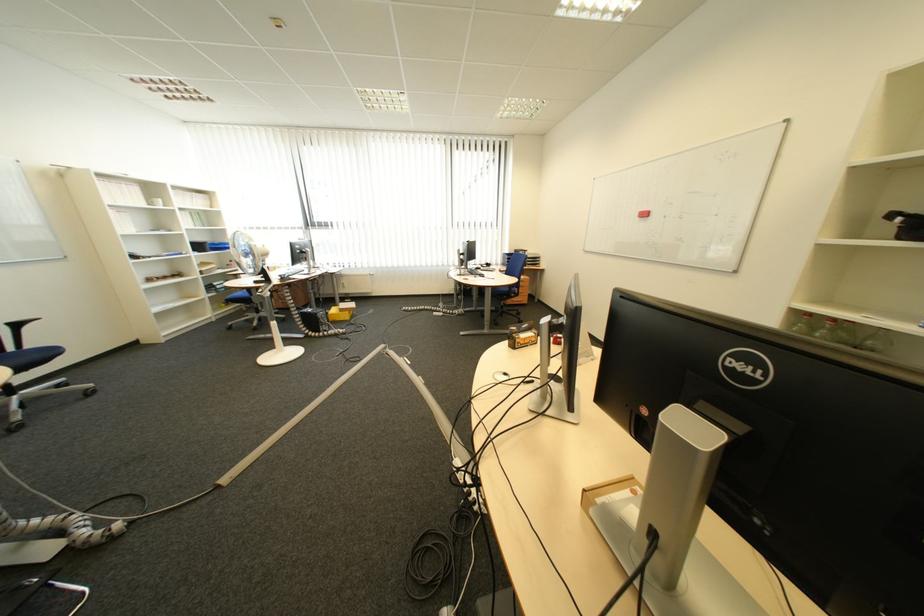
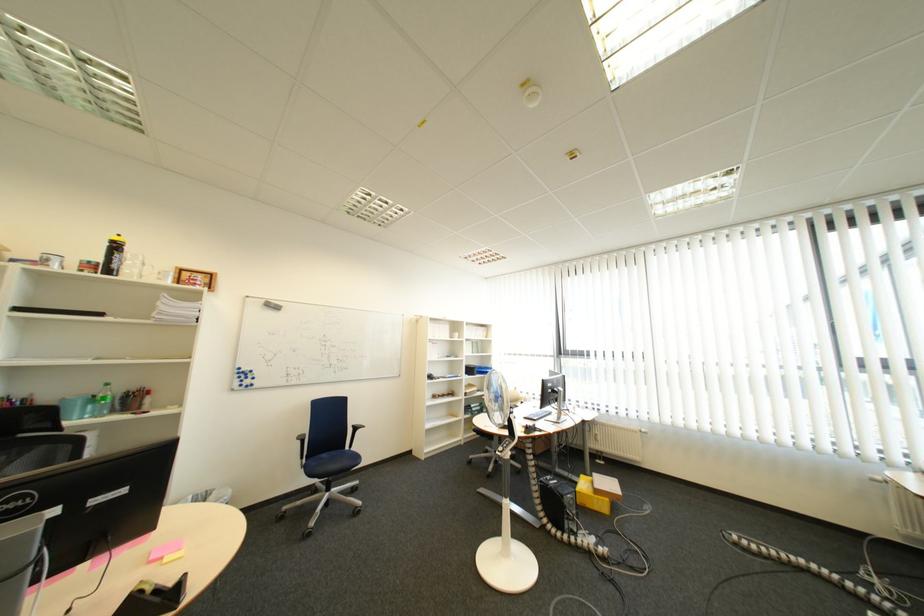
Locate, in the second image, the point that corresponds to (x=335, y=317) in the first image.

(585, 503)